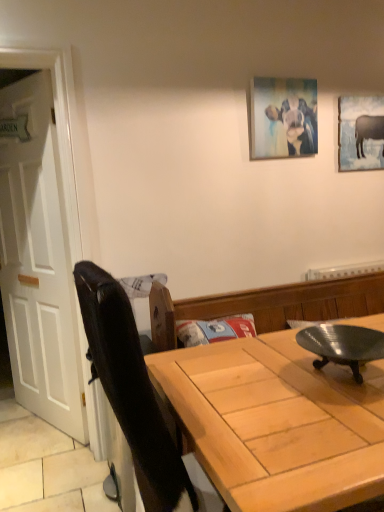
Question: In terms of size, does metallic silver plate at center appear bigger or smaller than light wood table at center?

Choices:
 (A) small
 (B) big

Answer: (A)

Question: Is metallic silver plate at center in front of or behind light wood table at center in the image?

Choices:
 (A) front
 (B) behind

Answer: (B)

Question: Which is farther from the matte canvas painting at upper center, marked as the 2th picture frame in a back-to-front arrangement?

Choices:
 (A) white wooden door at left
 (B) light wood table at center
 (C) matte gray cow at upper right, which appears as the second picture frame when viewed from the front
 (D) metallic silver plate at center

Answer: (B)

Question: Which object is positioned farthest from the metallic silver plate at center?

Choices:
 (A) matte gray cow at upper right, the second picture frame in the left-to-right sequence
 (B) white wooden door at left
 (C) light wood table at center
 (D) matte canvas painting at upper center, positioned as the 1th picture frame in left-to-right order

Answer: (B)